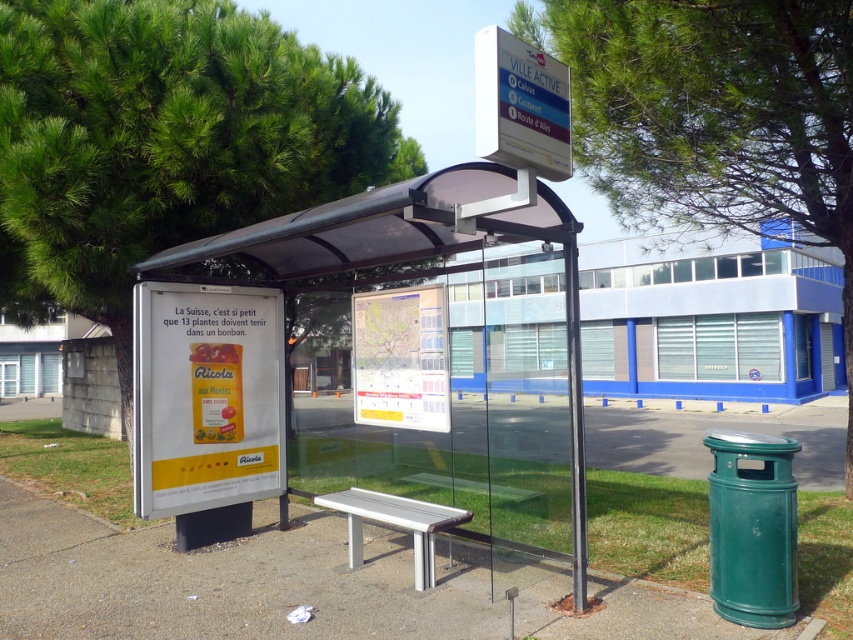
Question: Observing the image, what is the correct spatial positioning of concrete bench at center in reference to white plastic bench at center?

Choices:
 (A) left
 (B) right

Answer: (A)

Question: Estimate the real-world distances between objects in this image. Which object is farther from the yellow paper sign at center?

Choices:
 (A) white plastic bench at center
 (B) green leafy tree at upper left
 (C) silver metallic bench at center

Answer: (B)

Question: Can you confirm if concrete bench at center is wider than white plastic sign at upper center?

Choices:
 (A) no
 (B) yes

Answer: (B)

Question: Among these objects, which one is nearest to the camera?

Choices:
 (A) green leafy tree at upper left
 (B) paper map at center

Answer: (B)

Question: Based on their relative distances, which object is nearer to the paper map at center?

Choices:
 (A) concrete bench at center
 (B) silver metallic bench at center
 (C) green leafy tree at upper left
 (D) white plastic bench at center

Answer: (D)

Question: Does green leafy tree at upper center appear on the left side of silver metallic bench at center?

Choices:
 (A) yes
 (B) no

Answer: (B)